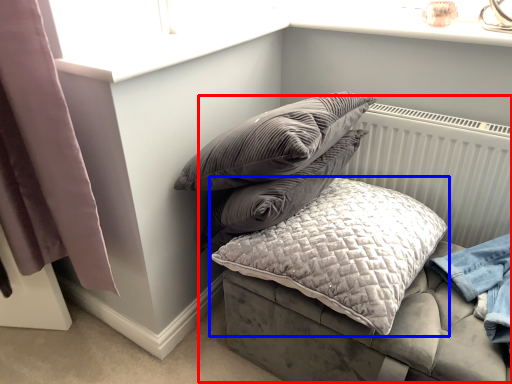
Question: Which point is closer to the camera, bed (highlighted by a red box) or pillow (highlighted by a blue box)?

Choices:
 (A) bed
 (B) pillow

Answer: (A)